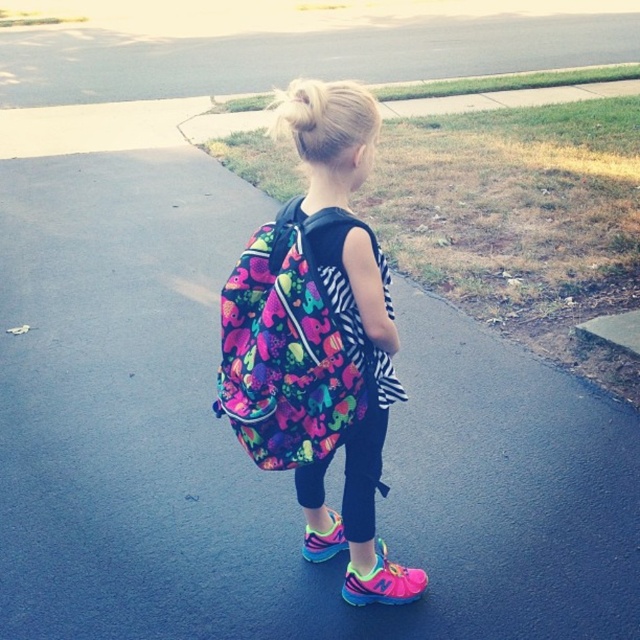
Question: Is green grass at upper center to the left of blonde hair at upper center from the viewer's perspective?

Choices:
 (A) yes
 (B) no

Answer: (B)

Question: Which of the following is the farthest from the observer?

Choices:
 (A) blonde hair at upper center
 (B) pink mesh shoe at lower center
 (C) green grass at upper center

Answer: (C)

Question: Estimate the real-world distances between objects in this image. Which object is farther from the blonde hair at upper center?

Choices:
 (A) green grass at upper center
 (B) neon floral backpack at center
 (C) pink mesh shoe at lower center

Answer: (A)

Question: Observing the image, what is the correct spatial positioning of pink mesh shoe at lower center in reference to pink fabric shoe at lower center?

Choices:
 (A) below
 (B) above

Answer: (A)

Question: Does multicolored fabric backpack at center appear on the left side of blonde hair at upper center?

Choices:
 (A) yes
 (B) no

Answer: (B)

Question: Which of these objects is positioned farthest from the green grass at upper center?

Choices:
 (A) multicolored fabric backpack at center
 (B) pink fabric shoe at lower center
 (C) pink mesh shoe at lower center

Answer: (A)